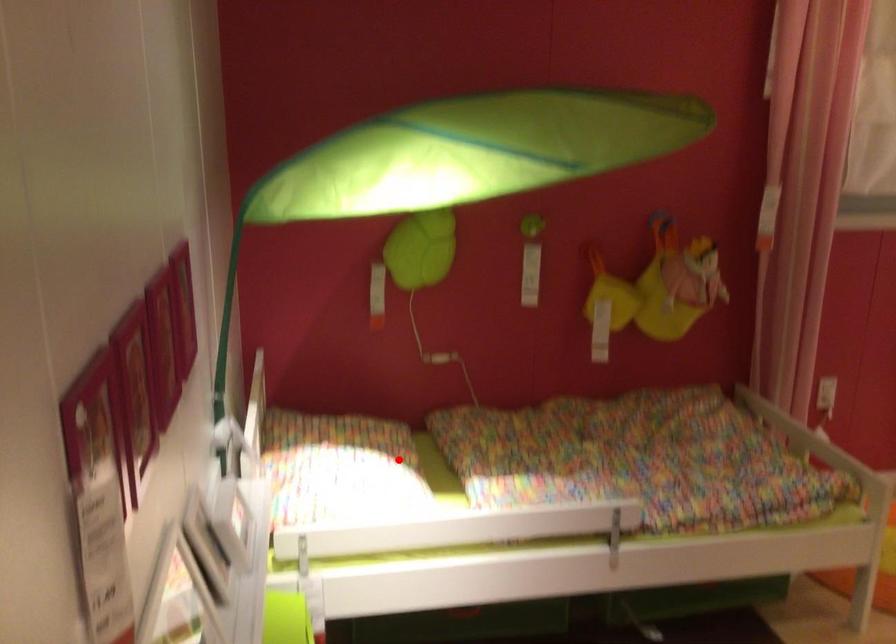
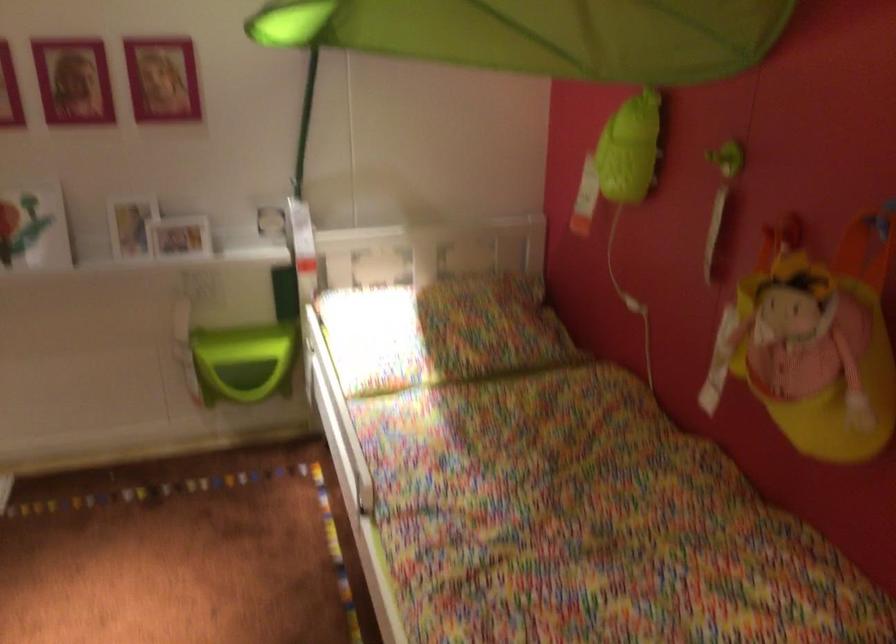
Where in the second image is the point corresponding to the highlighted location from the first image?

(440, 332)